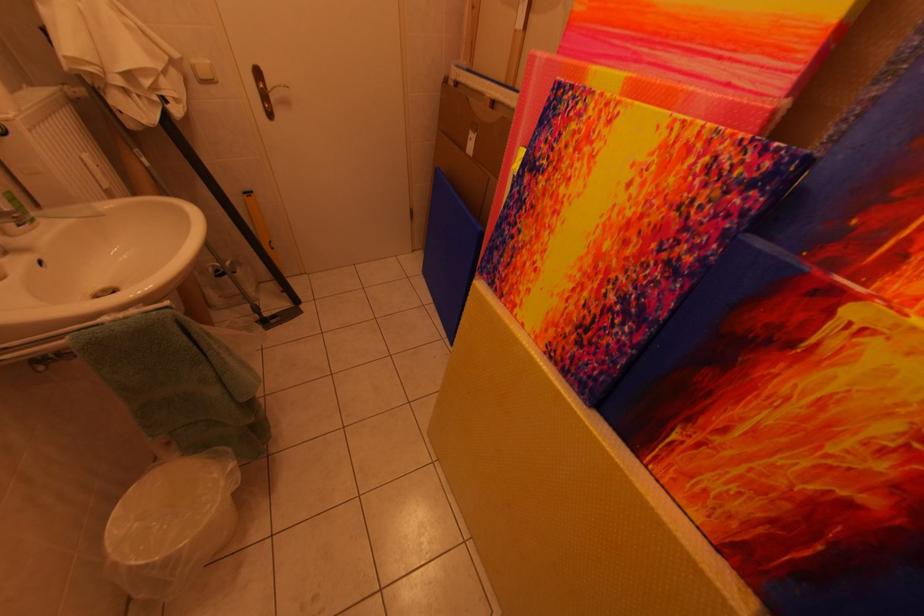
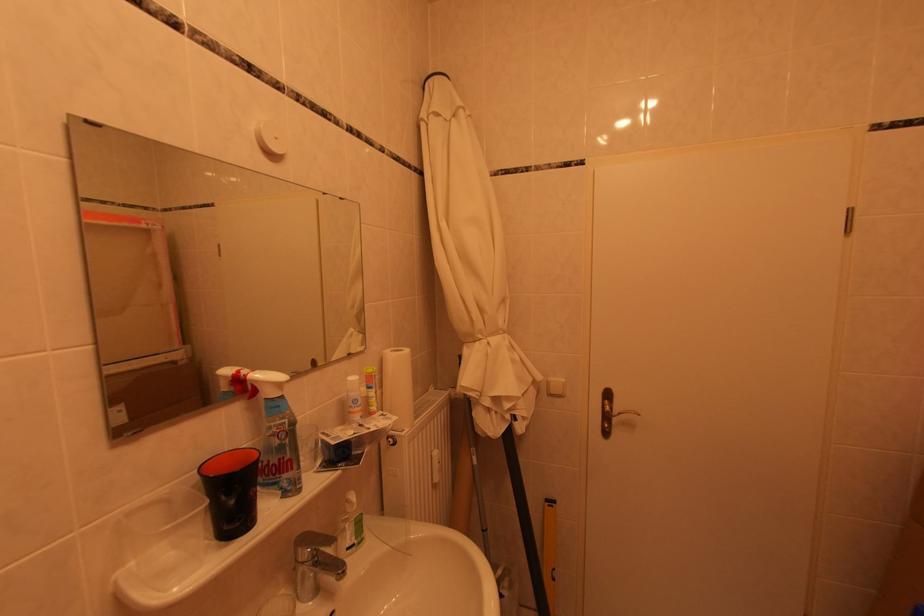
The first image is from the beginning of the video and the second image is from the end. How did the camera likely rotate when shooting the video?

The camera rotated toward left-up.